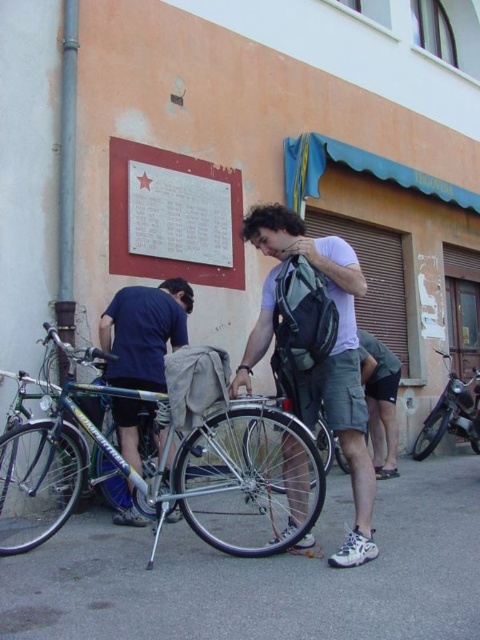
Who is shorter, matte gray backpack at center or white matte signboard at upper left?

Standing shorter between the two is white matte signboard at upper left.

Between matte gray backpack at center and white matte signboard at upper left, which one is positioned lower?

matte gray backpack at center

Who is more forward, [303,497] or [136,266]?

Point [303,497] is more forward.

Find the location of `matte gray backpack at center`. matte gray backpack at center is located at coordinates (323, 360).

Does point (80, 448) come in front of point (111, 324)?

Yes, point (80, 448) is in front of point (111, 324).

Can you confirm if green metallic bicycle at center is taller than blue fabric pants at lower left?

No, green metallic bicycle at center is not taller than blue fabric pants at lower left.

The image size is (480, 640). Describe the element at coordinates (154, 472) in the screenshot. I see `green metallic bicycle at center` at that location.

Locate an element on the screen. The height and width of the screenshot is (640, 480). green metallic bicycle at center is located at coordinates (154, 472).

Can you confirm if matte gray backpack at center is wider than blue fabric pants at lower left?

Yes.

Does point (297, 474) come behind point (154, 296)?

No, (297, 474) is closer to viewer.

Identify the location of matte gray backpack at center. (323, 360).